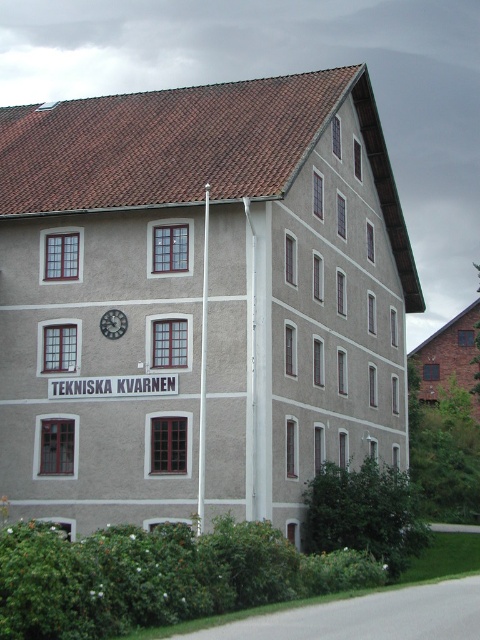
You are standing in front of the building and see a point marked at coordinates (203, 369). Can you tell me what object this point is located on?

The point at coordinates (203, 369) is located on the white plastic pole at center.

You are standing in front of the building and want to touch both the white plastic pole at center and the metallic clock at center. Which object will you reach first?

The white plastic pole at center is closer to the viewer than the metallic clock at center, so you will reach the white plastic pole at center first.

You are standing in front of the building and want to locate the white plastic pole at center. Based on the coordinates provided, where would you find it relative to the clock mounted on the second floor?

The white plastic pole at center is located at coordinates point (203, 369), which places it slightly to the right and below the clock mounted on the second floor.